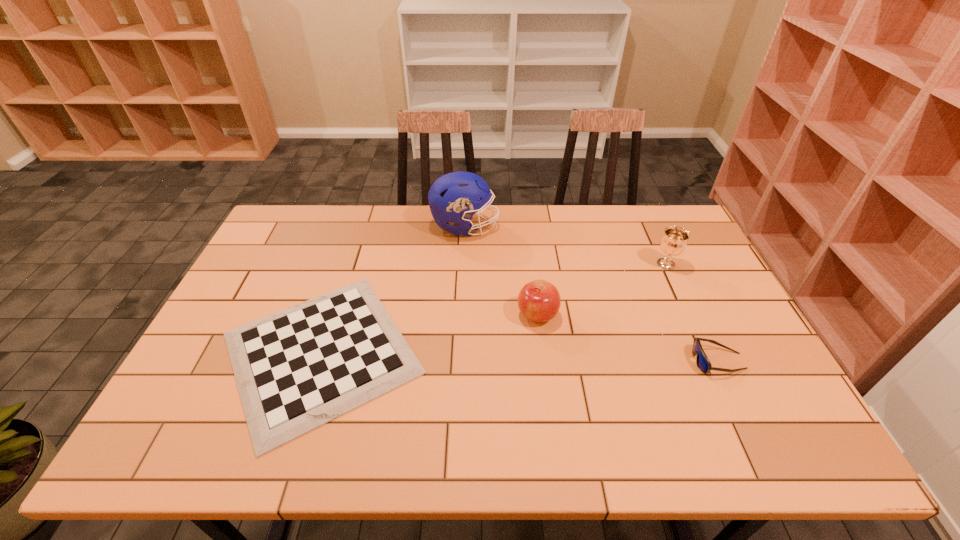
Where is `the tallest object`? The height and width of the screenshot is (540, 960). the tallest object is located at coordinates tap(455, 197).

What are the coordinates of `the farthest object` in the screenshot? It's located at (455, 197).

Locate an element on the screen. The image size is (960, 540). the fourth nearest object is located at coordinates (674, 241).

This screenshot has height=540, width=960. I want to click on apple, so click(x=539, y=301).

The height and width of the screenshot is (540, 960). I want to click on the third object from left to right, so click(x=539, y=301).

Locate an element on the screen. This screenshot has height=540, width=960. sunglasses is located at coordinates (703, 363).

Where is `the shortest object`? The height and width of the screenshot is (540, 960). the shortest object is located at coordinates (297, 369).

The width and height of the screenshot is (960, 540). I want to click on free space located on the front-facing side of the football helmet, so click(x=578, y=226).

Locate an element on the screen. free space located on the front of the second farthest object is located at coordinates (705, 348).

Where is `vacant space located on the front of the apple`? This screenshot has width=960, height=540. vacant space located on the front of the apple is located at coordinates (554, 441).